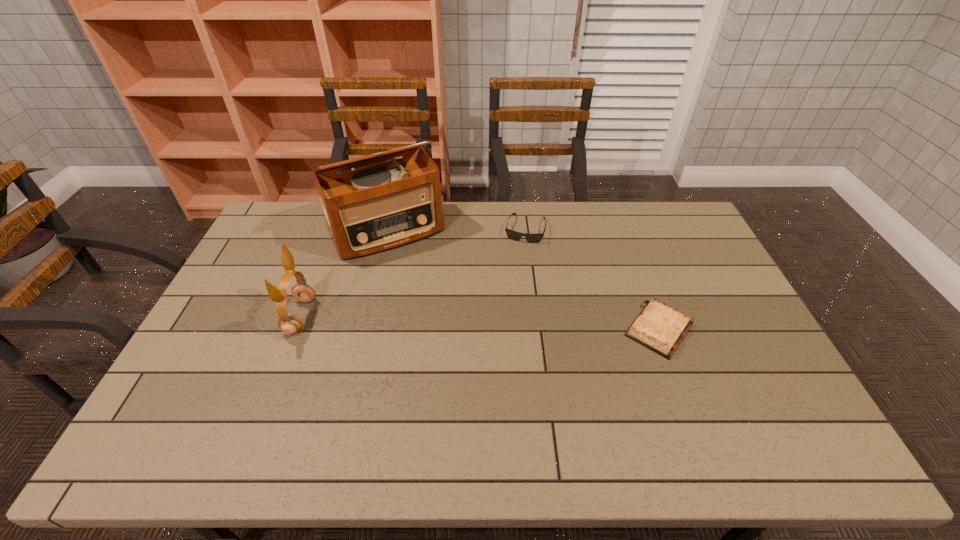
The width and height of the screenshot is (960, 540). What are the coordinates of `earphone` in the screenshot? It's located at (289, 324).

Where is `the rightmost object`? The image size is (960, 540). the rightmost object is located at coordinates (659, 327).

Locate an element on the screen. The image size is (960, 540). diary is located at coordinates (659, 327).

The image size is (960, 540). Identify the location of the third object from left to right. [514, 235].

Where is `the second shortest object`? The height and width of the screenshot is (540, 960). the second shortest object is located at coordinates (514, 235).

Find the location of a particular element. Image resolution: width=960 pixels, height=540 pixels. the tallest object is located at coordinates (381, 207).

Where is `free space located 0.070m on the front-facing side of the earphone`? free space located 0.070m on the front-facing side of the earphone is located at coordinates (265, 316).

Where is `free space located on the front-facing side of the earphone`? free space located on the front-facing side of the earphone is located at coordinates (269, 316).

At what (x,y) coordinates should I click in order to perform the action: click on free spot located on the front-facing side of the earphone. Please return your answer as a coordinate pair (x, y). This screenshot has height=540, width=960. Looking at the image, I should click on (219, 316).

This screenshot has width=960, height=540. In order to click on vacant space situated 0.080m on the front of the diary in this screenshot , I will do `click(680, 386)`.